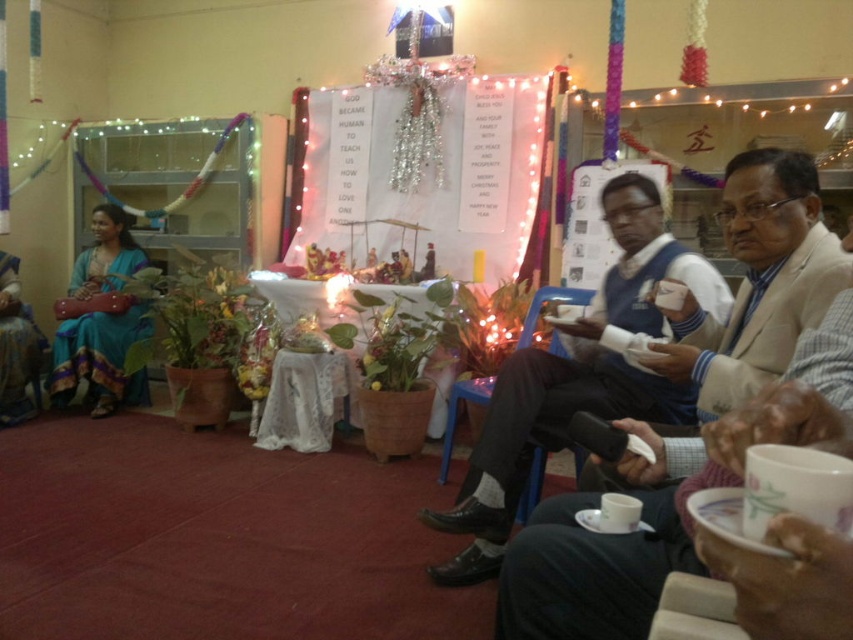
Question: Does blue sweater at center appear under matte blue dress at left?

Choices:
 (A) no
 (B) yes

Answer: (B)

Question: Which point is closer to the camera?

Choices:
 (A) (486, 380)
 (B) (677, 257)

Answer: (B)

Question: Does light beige suit at right appear on the left side of white plastic chair at lower right?

Choices:
 (A) no
 (B) yes

Answer: (A)

Question: Among these objects, which one is farthest from the camera?

Choices:
 (A) blue sweater at center
 (B) light beige suit at right
 (C) blue plastic chair at center

Answer: (C)

Question: Which of these objects is positioned closest to the light beige suit at right?

Choices:
 (A) blue sweater at center
 (B) matte blue dress at left

Answer: (A)

Question: Is light beige suit at right to the left of matte blue dress at left from the viewer's perspective?

Choices:
 (A) no
 (B) yes

Answer: (A)